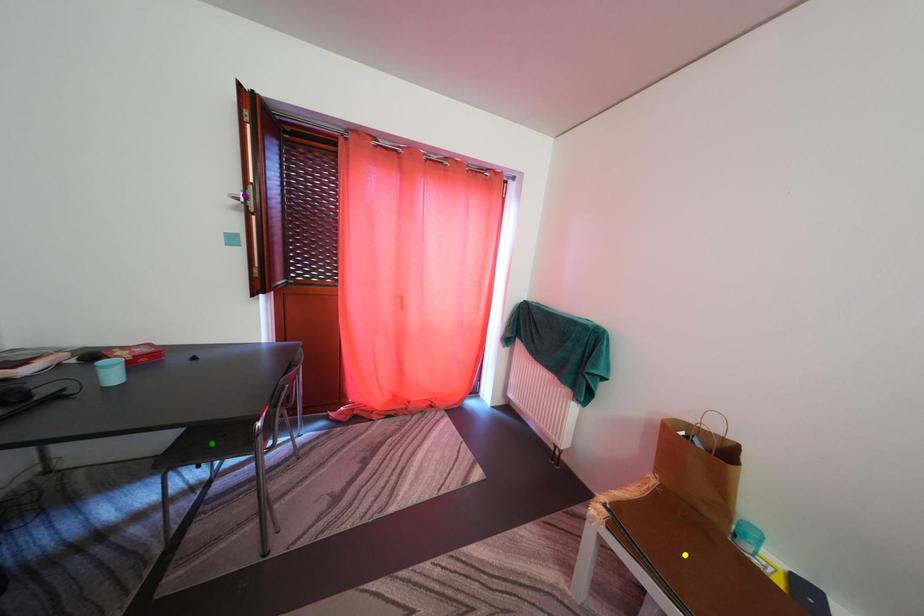
Order these from nearest to farthest:
A) green point
B) purple point
C) yellow point

1. yellow point
2. green point
3. purple point